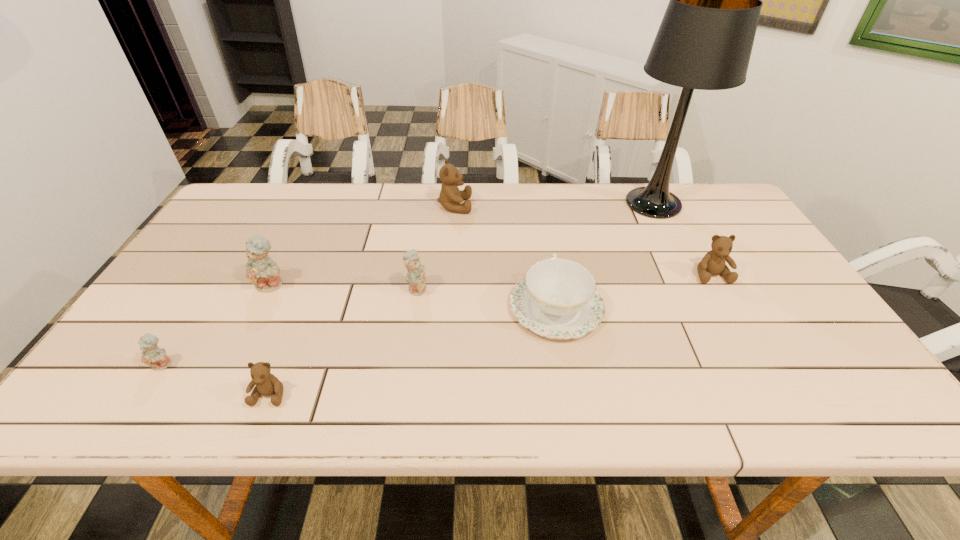
Find the location of `object that is at the far right corner`. object that is at the far right corner is located at coordinates (705, 39).

What are the coordinates of `free space at the far edge of the desktop` in the screenshot? It's located at (557, 187).

In the image, there is a desktop. Identify the location of free space at the near edge. (680, 414).

The width and height of the screenshot is (960, 540). In the image, there is a desktop. Identify the location of blank space at the right edge. (721, 228).

At what (x,y) coordinates should I click in order to perform the action: click on vacant space at the far right corner. Please return your answer as a coordinate pair (x, y). Looking at the image, I should click on (708, 219).

I want to click on unoccupied area between the second biggest blue teddy bear and the nearest teddy bear, so click(344, 341).

I want to click on free space between the nearest brown teddy bear and the blue chinaware, so click(x=413, y=351).

Locate an element on the screen. This screenshot has height=540, width=960. blank region between the table lamp and the smallest blue teddy bear is located at coordinates pos(408,284).

Find the location of `unoccupied position between the tallest object and the second biggest blue teddy bear`. unoccupied position between the tallest object and the second biggest blue teddy bear is located at coordinates (536, 246).

Locate an element on the screen. This screenshot has width=960, height=540. empty space that is in between the second biggest brown teddy bear and the leftmost teddy bear is located at coordinates (437, 319).